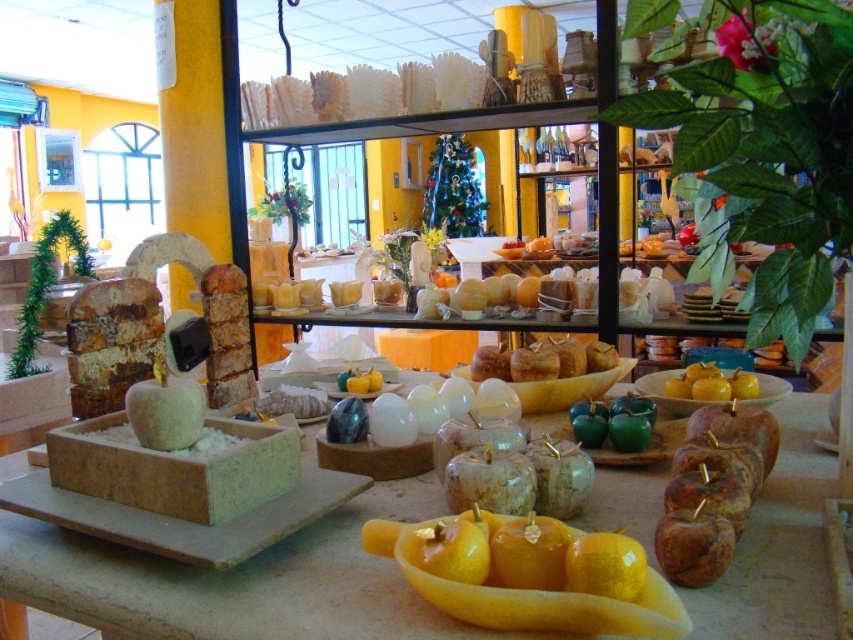
You are a customer at a craft fair and want to place the yellow glossy apples at center into the matte stone bowl at center. Can you fit them inside based on their sizes?

The matte stone bowl at center has a greater height compared to yellow glossy apples at center, so the apples can likely fit inside the bowl as the bowl is taller than the apples.

You are a customer at a craft fair and see the yellow wax candle at center and the yellow glossy apples at center on a table. Which item is positioned more to the left?

The yellow wax candle at center is positioned more to the left than the yellow glossy apples at center.

You are a customer at the craft fair and want to place the yellow wax candle at center on top of the matte stone bowl at center. Will the candle fit on top of the bowl?

The matte stone bowl at center is taller than the yellow wax candle at center, so the candle will likely fit on top of the bowl as it is shorter in height.